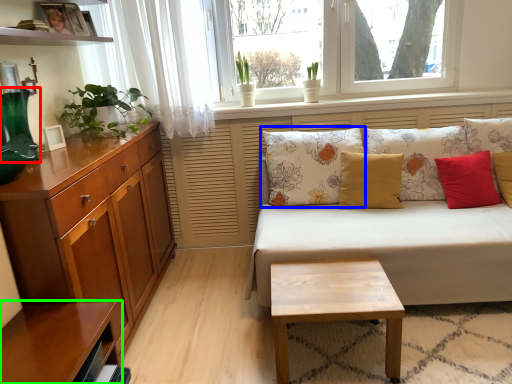
Question: Which is nearer to the vase (highlighted by a red box)? pillow (highlighted by a blue box) or shelf (highlighted by a green box).

Choices:
 (A) pillow
 (B) shelf

Answer: (B)